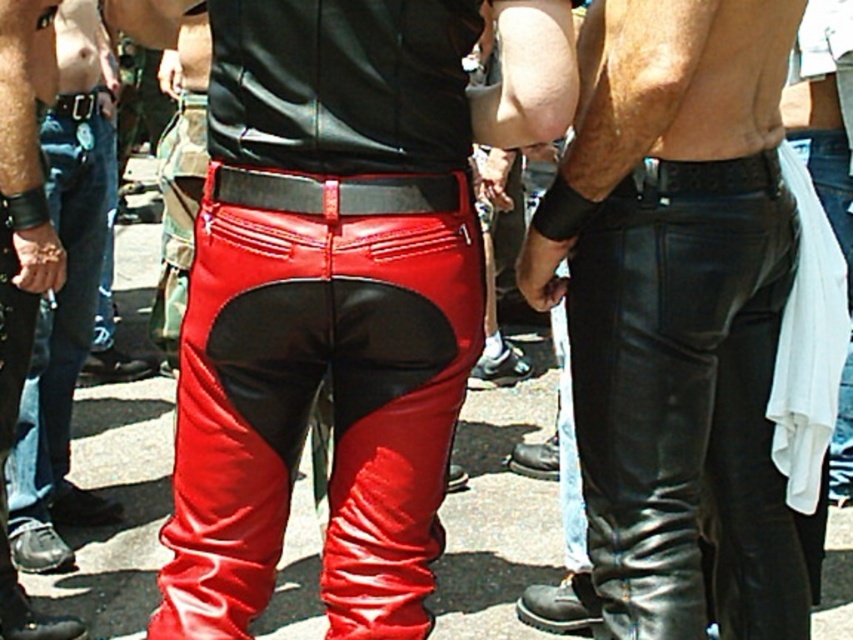
Question: Among these points, which one is nearest to the camera?

Choices:
 (A) (50, 170)
 (B) (372, 195)
 (C) (612, 365)
 (D) (231, 236)

Answer: (B)

Question: Is shiny leather pants at center smaller than black leather belt at center?

Choices:
 (A) no
 (B) yes

Answer: (A)

Question: Is shiny leather pants at center to the left of shiny red leather pants at center from the viewer's perspective?

Choices:
 (A) yes
 (B) no

Answer: (B)

Question: Which of the following is the closest to the observer?

Choices:
 (A) (744, 333)
 (B) (42, 392)

Answer: (A)

Question: Where is shiny red leather pants at center located in relation to black leather belt at center in the image?

Choices:
 (A) below
 (B) above

Answer: (A)

Question: Among these objects, which one is farthest from the camera?

Choices:
 (A) shiny red leather pants at center
 (B) shiny leather pants at center

Answer: (A)